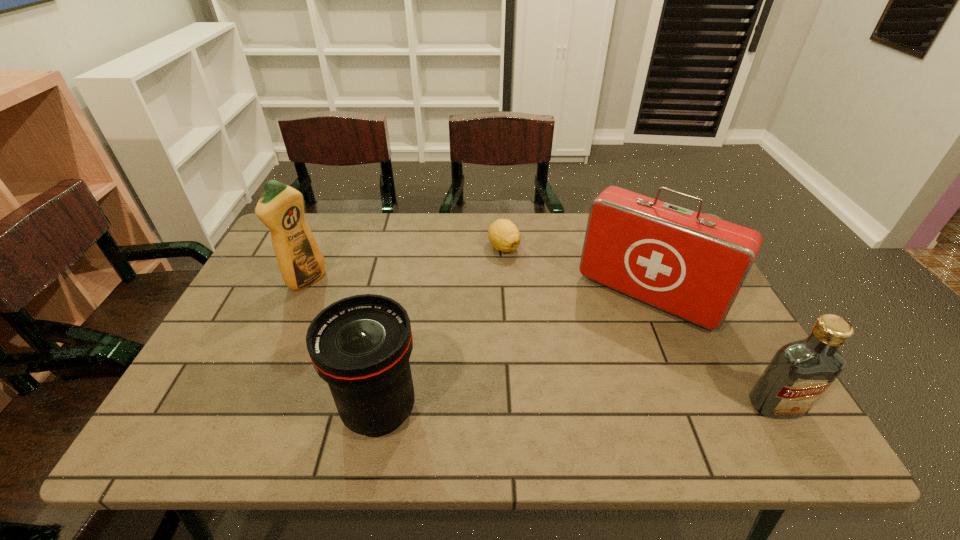
Image resolution: width=960 pixels, height=540 pixels. Find the location of `blank space located 0.230m on the side of the first-aid kit with the first aid cross symbol`. blank space located 0.230m on the side of the first-aid kit with the first aid cross symbol is located at coordinates (577, 391).

Locate an element on the screen. This screenshot has width=960, height=540. vacant point located 0.140m on the side of the first-aid kit with the first aid cross symbol is located at coordinates (595, 364).

The height and width of the screenshot is (540, 960). I want to click on free space located 0.110m on the side of the first-aid kit with the first aid cross symbol, so click(601, 356).

The image size is (960, 540). Identify the location of free space located at the stem end of the lemon. (516, 318).

Find the location of a particular element. The image size is (960, 540). vacant point located 0.340m at the stem end of the lemon is located at coordinates (521, 348).

This screenshot has width=960, height=540. Identify the location of free space located 0.310m at the stem end of the lemon. pos(520,338).

Identify the location of object that is at the far edge. (504, 236).

Identify the location of telephoto lens positioned at the near edge. The height and width of the screenshot is (540, 960). (360, 345).

Find the location of a particular element. The height and width of the screenshot is (540, 960). vodka that is positioned at the near edge is located at coordinates (800, 372).

You are a GUI agent. You are given a task and a screenshot of the screen. Output one action in this format:
    pyautogui.click(x=<x>, y=<y>)
    Task: Click on the object at the left edge
    The width and height of the screenshot is (960, 540).
    Given the screenshot: What is the action you would take?
    pyautogui.click(x=280, y=207)